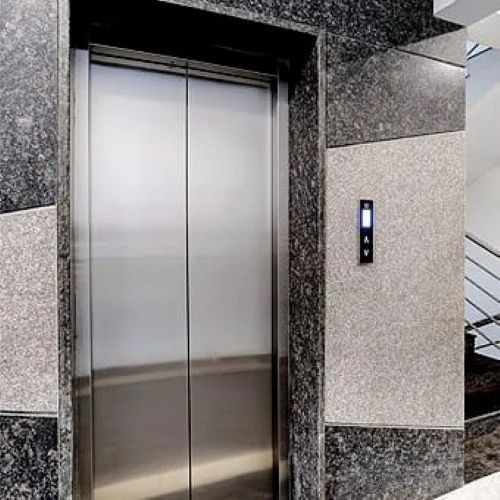
The image size is (500, 500). Identify the location of elevator button screen. (364, 219).